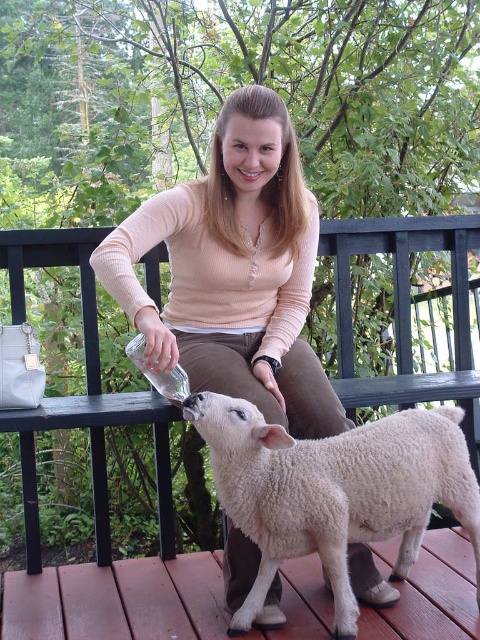
Question: Which of the following is the farthest from the observer?

Choices:
 (A) white woolen lamb at lower center
 (B) matte peach sweater at center

Answer: (B)

Question: Which of the following is the closest to the observer?

Choices:
 (A) matte peach sweater at center
 (B) white woolen lamb at lower center

Answer: (B)

Question: Does matte peach sweater at center appear under white woolen lamb at lower center?

Choices:
 (A) no
 (B) yes

Answer: (A)

Question: Which point is farther from the camera taking this photo?

Choices:
 (A) (331, 456)
 (B) (210, 330)

Answer: (B)

Question: Is matte peach sweater at center to the left of white woolen lamb at lower center from the viewer's perspective?

Choices:
 (A) no
 (B) yes

Answer: (B)

Question: Is matte peach sweater at center smaller than white woolen lamb at lower center?

Choices:
 (A) no
 (B) yes

Answer: (A)